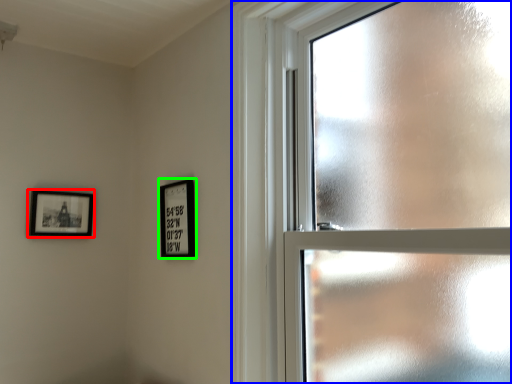
Question: Which object is positioned farthest from picture frame (highlighted by a red box)? Select from window (highlighted by a blue box) and picture frame (highlighted by a green box).

Choices:
 (A) window
 (B) picture frame

Answer: (A)